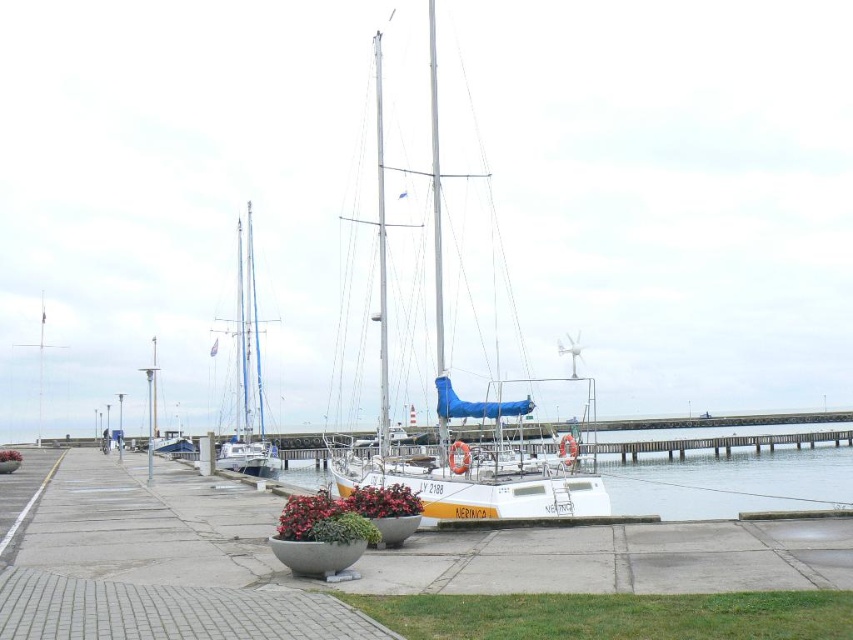
Is the position of white water at center less distant than that of white glossy sailboat at left?

Yes, white water at center is in front of white glossy sailboat at left.

Is point (283, 451) less distant than point (241, 280)?

No, it is behind (241, 280).

Identify the location of white water at center. (730, 472).

Who is lower down, white sailboat at center or white water at center?

white water at center

Does white sailboat at center have a greater width compared to white water at center?

Incorrect, white sailboat at center's width does not surpass white water at center's.

The width and height of the screenshot is (853, 640). I want to click on white sailboat at center, so click(x=460, y=403).

Find the location of a particular element. The width and height of the screenshot is (853, 640). white sailboat at center is located at coordinates (460, 403).

Is white sailboat at center to the left of white glossy sailboat at left from the viewer's perspective?

Incorrect, white sailboat at center is not on the left side of white glossy sailboat at left.

Is white sailboat at center wider than white glossy sailboat at left?

No.

You are a GUI agent. You are given a task and a screenshot of the screen. Output one action in this format:
    pyautogui.click(x=<x>, y=<y>)
    Task: Click on the white sailboat at center
    This screenshot has height=640, width=853.
    Given the screenshot: What is the action you would take?
    pyautogui.click(x=460, y=403)

This screenshot has width=853, height=640. In order to click on white sailboat at center in this screenshot , I will do `click(460, 403)`.